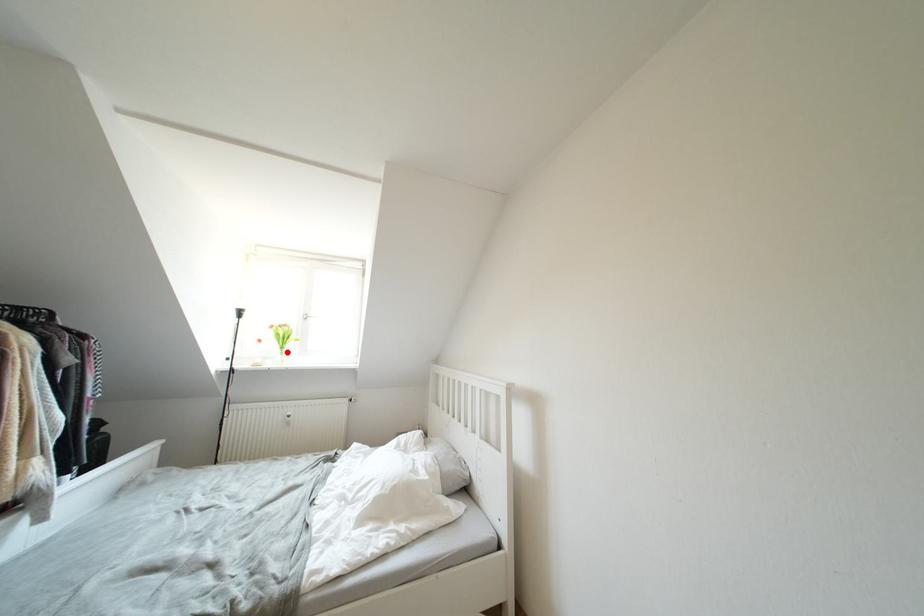
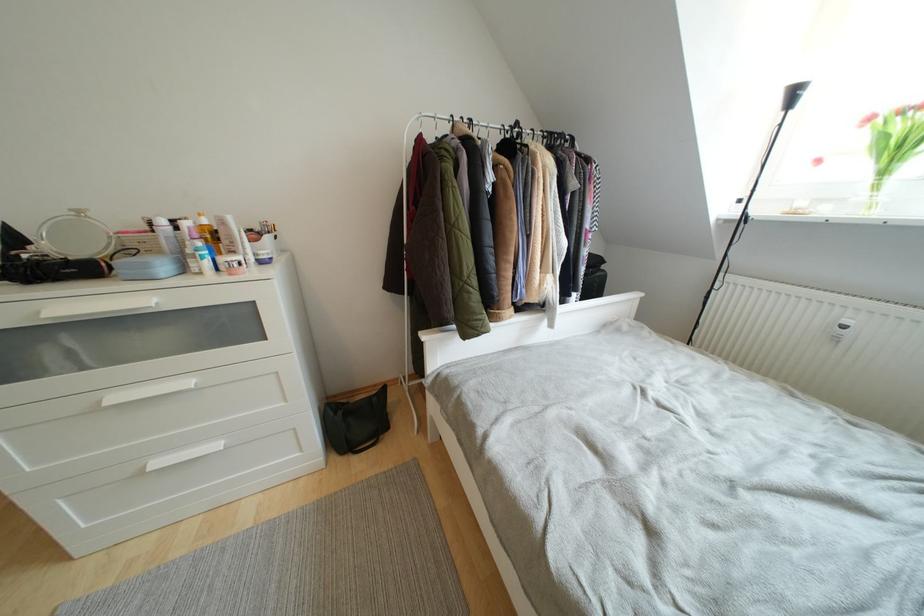
Question: I am providing you with two images of the same scene from different viewpoints. A red point is shown in image1. For the corresponding object point in image2, is it positioned nearer or farther from the camera?

Choices:
 (A) Nearer
 (B) Farther

Answer: (B)